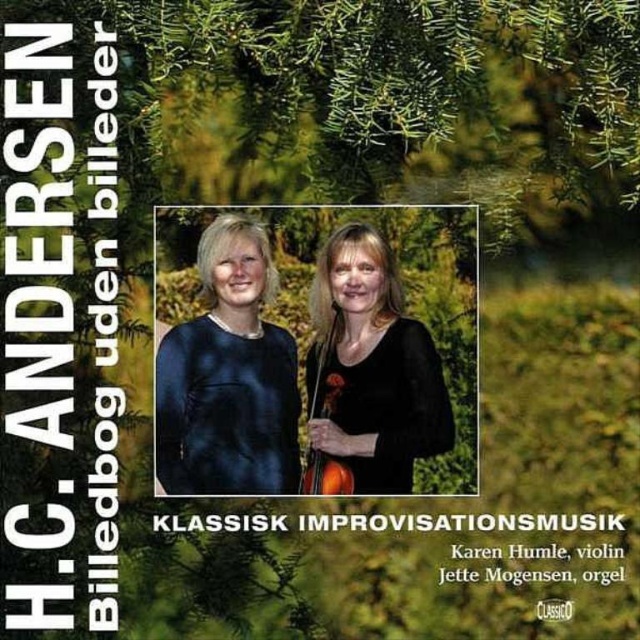
Between point (248, 436) and point (324, 314), which one is positioned behind?

Point (324, 314)

Which is below, matte black dress at center or black matte dress at center?

black matte dress at center is lower down.

What do you see at coordinates (228, 378) in the screenshot?
I see `matte black dress at center` at bounding box center [228, 378].

This screenshot has height=640, width=640. In order to click on matte black dress at center in this screenshot , I will do `click(228, 378)`.